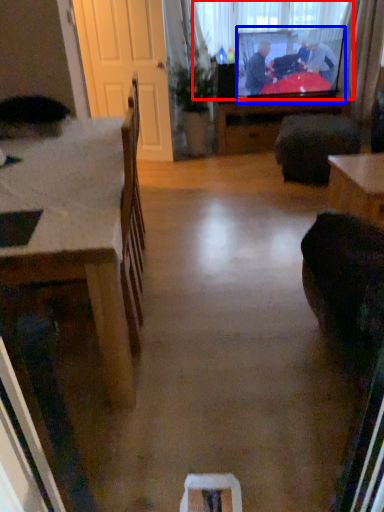
Question: Which of the following is the farthest to the observer, window screen (highlighted by a red box) or television (highlighted by a blue box)?

Choices:
 (A) window screen
 (B) television

Answer: (A)